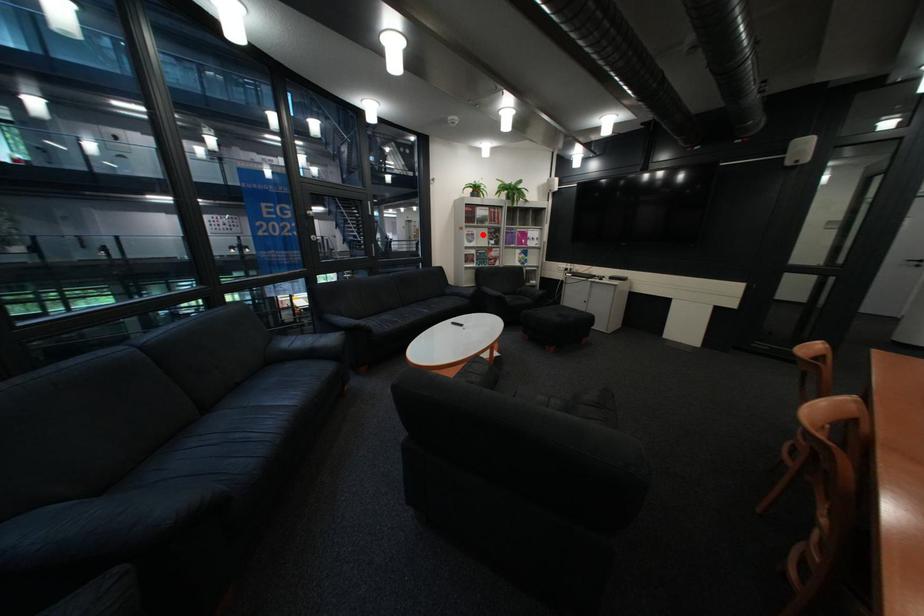
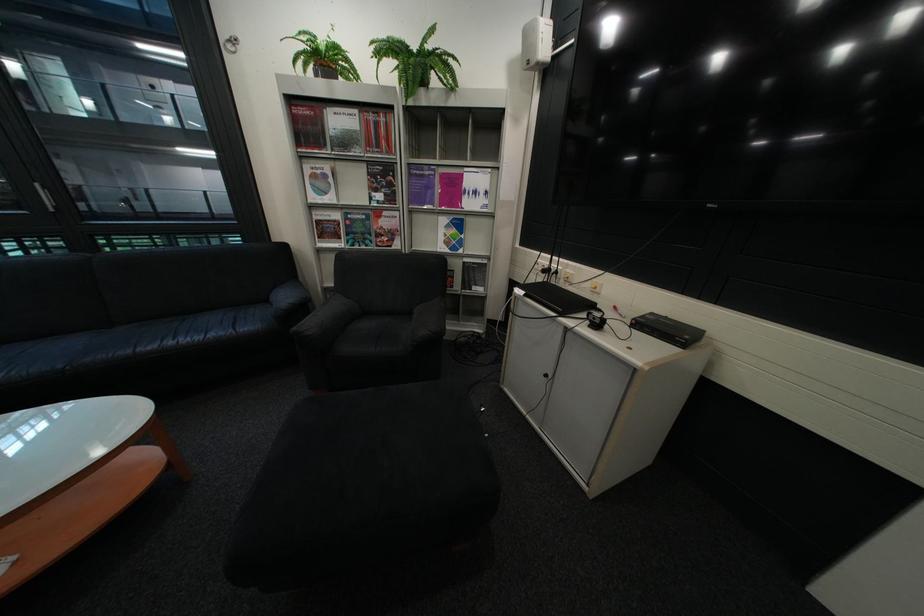
Question: A red point is marked in image1. In image2, is the corresponding 3D point closer to the camera or farther? Reply with the corresponding letter.

Choices:
 (A) The corresponding 3D point is closer.
 (B) The corresponding 3D point is farther.

Answer: (B)